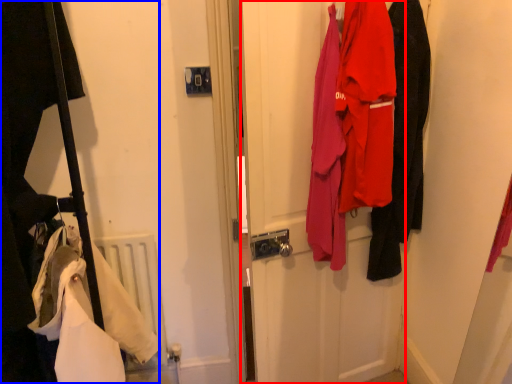
Question: Among these objects, which one is nearest to the camera, door (highlighted by a red box) or closet (highlighted by a blue box)?

Choices:
 (A) door
 (B) closet

Answer: (B)